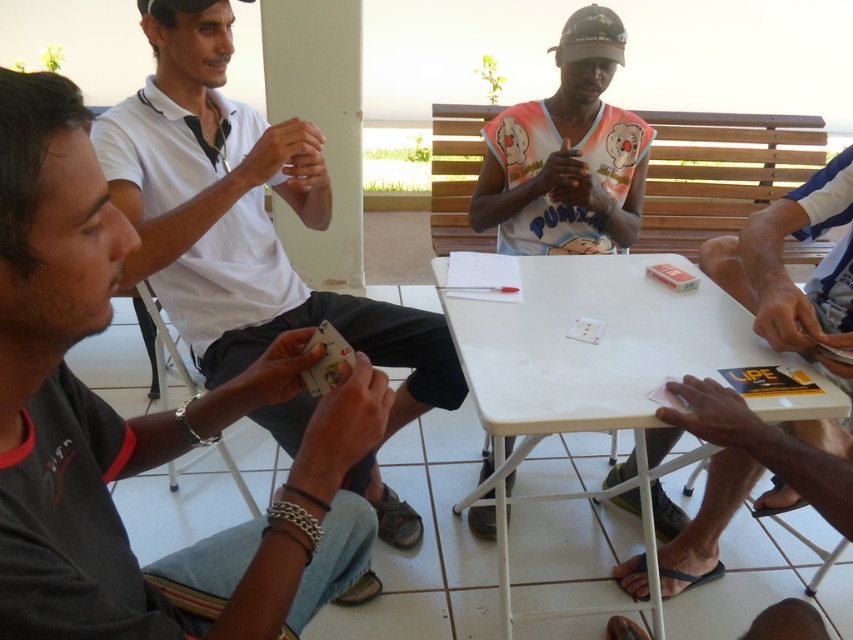
Can you confirm if white matte shirt at left is positioned to the left of white plastic table at center?

Correct, you'll find white matte shirt at left to the left of white plastic table at center.

What do you see at coordinates (241, 218) in the screenshot?
I see `white matte shirt at left` at bounding box center [241, 218].

Locate an element on the screen. The width and height of the screenshot is (853, 640). white matte shirt at left is located at coordinates (241, 218).

This screenshot has width=853, height=640. What are the coordinates of `white matte shirt at left` in the screenshot? It's located at point(241,218).

Who is taller, white matte shirt at left or pink matte card at lower right?

With more height is white matte shirt at left.

Consider the image. Does white matte shirt at left have a larger size compared to pink matte card at lower right?

Yes.

Describe the element at coordinates (241, 218) in the screenshot. I see `white matte shirt at left` at that location.

Identify the location of white matte shirt at left. This screenshot has height=640, width=853. (241, 218).

Can you confirm if white matte shirt at left is thinner than white sleeveless shirt at center?

In fact, white matte shirt at left might be wider than white sleeveless shirt at center.

Between point (389, 324) and point (582, 163), which one is positioned behind?

Point (582, 163)

Measure the distance between point (392,419) and camera.

They are 6.44 feet apart.

Where is `white matte shirt at left`? white matte shirt at left is located at coordinates (241, 218).